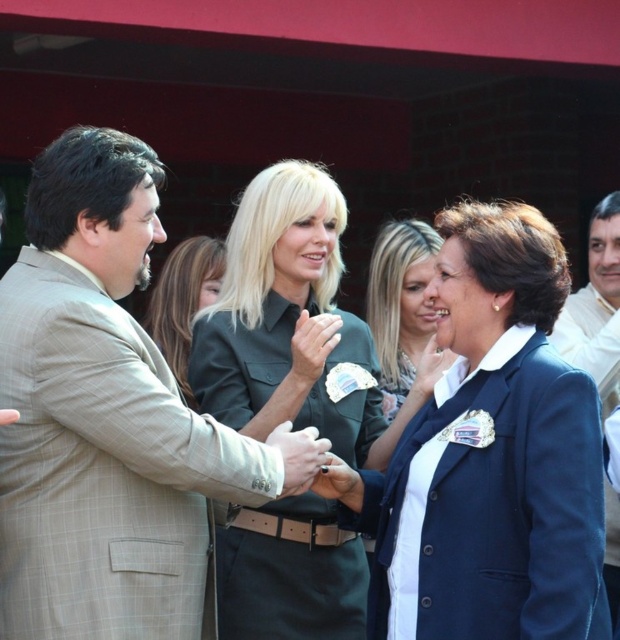
Question: Does green uniform at center come behind light brown suit at right?

Choices:
 (A) yes
 (B) no

Answer: (B)

Question: Which object is closer to the camera taking this photo?

Choices:
 (A) navy blue fabric business suit at center
 (B) blue fabric jacket at center
 (C) light brown suit at right

Answer: (A)

Question: Can you confirm if blue fabric jacket at center is positioned below light brown suit at right?

Choices:
 (A) yes
 (B) no

Answer: (A)

Question: Is the position of blue fabric jacket at center more distant than that of matte black shirt at center?

Choices:
 (A) yes
 (B) no

Answer: (B)

Question: Which of the following is the farthest from the observer?

Choices:
 (A) (618, 566)
 (B) (246, 339)
 (C) (528, 346)
 (D) (155, 308)

Answer: (D)

Question: Which of these objects is positioned closest to the blue fabric jacket at center?

Choices:
 (A) green uniform at center
 (B) beige checkered suit at left

Answer: (A)